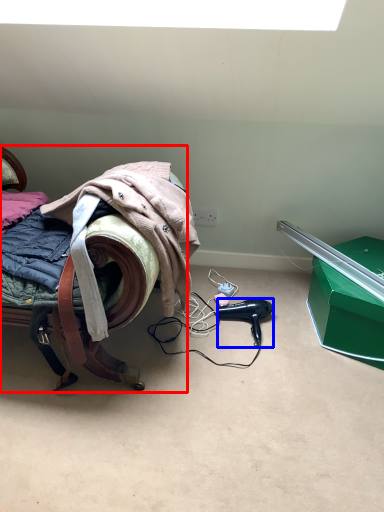
Question: Among these objects, which one is nearest to the camera, furniture (highlighted by a red box) or hair dryer (highlighted by a blue box)?

Choices:
 (A) furniture
 (B) hair dryer

Answer: (A)